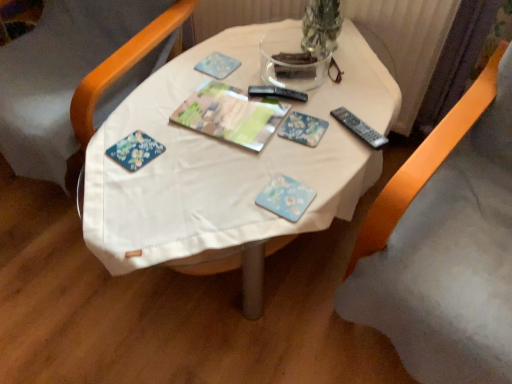
You are a GUI agent. You are given a task and a screenshot of the screen. Output one action in this format:
    pyautogui.click(x=<x>, y=<y>)
    Task: Click on the vacant space that is to the left of blue floral coaster at center, which is the second paperback book from top to bottom
    The height and width of the screenshot is (384, 512).
    Given the screenshot: What is the action you would take?
    pyautogui.click(x=214, y=194)